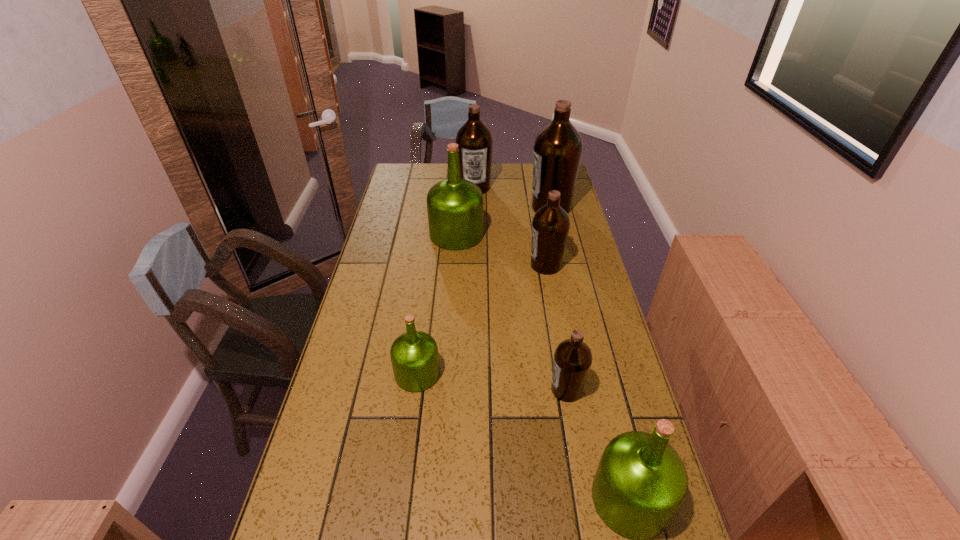
Choose which brown olive oil is the nearest neighbor to the biggest brown olive oil. Please provide its 2D coordinates. Your answer should be formatted as a tuple, i.e. [(x, y)], where the tuple contains the x and y coordinates of a point satisfying the conditions above.

[(475, 142)]

Point out which brown olive oil is positioned as the nearest to the fourth nearest object. Please provide its 2D coordinates. Your answer should be formatted as a tuple, i.e. [(x, y)], where the tuple contains the x and y coordinates of a point satisfying the conditions above.

[(558, 147)]

Locate which green olive oil is the closest to the smallest green olive oil. Please provide its 2D coordinates. Your answer should be formatted as a tuple, i.e. [(x, y)], where the tuple contains the x and y coordinates of a point satisfying the conditions above.

[(640, 483)]

Where is `green olive oil identified as the closest to the nearest green olive oil`? The width and height of the screenshot is (960, 540). green olive oil identified as the closest to the nearest green olive oil is located at coordinates (414, 355).